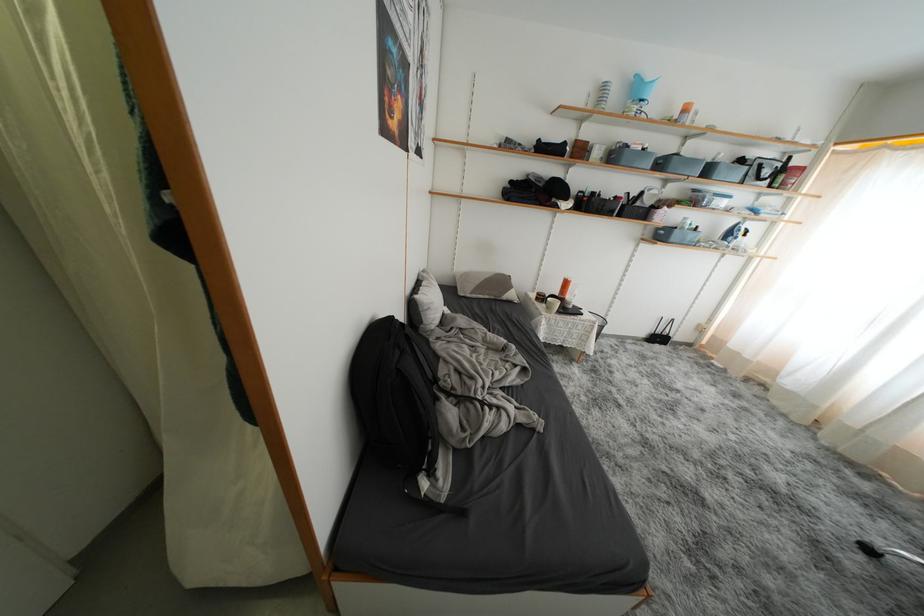
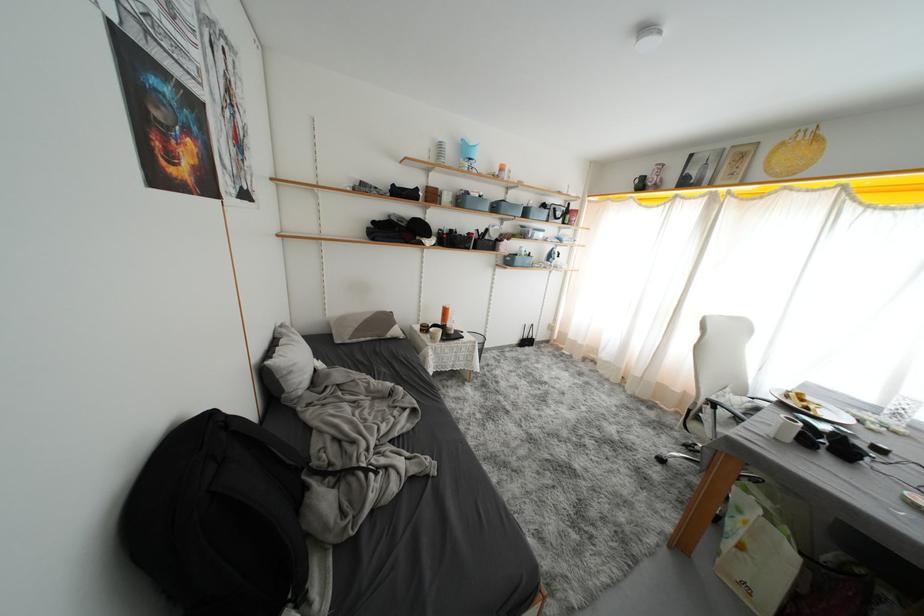
Question: The camera is either moving clockwise (left) or counter-clockwise (right) around the object. The first image is from the beginning of the video and the second image is from the end. Is the camera moving left or right when shooting the video?

Choices:
 (A) Left
 (B) Right

Answer: (A)